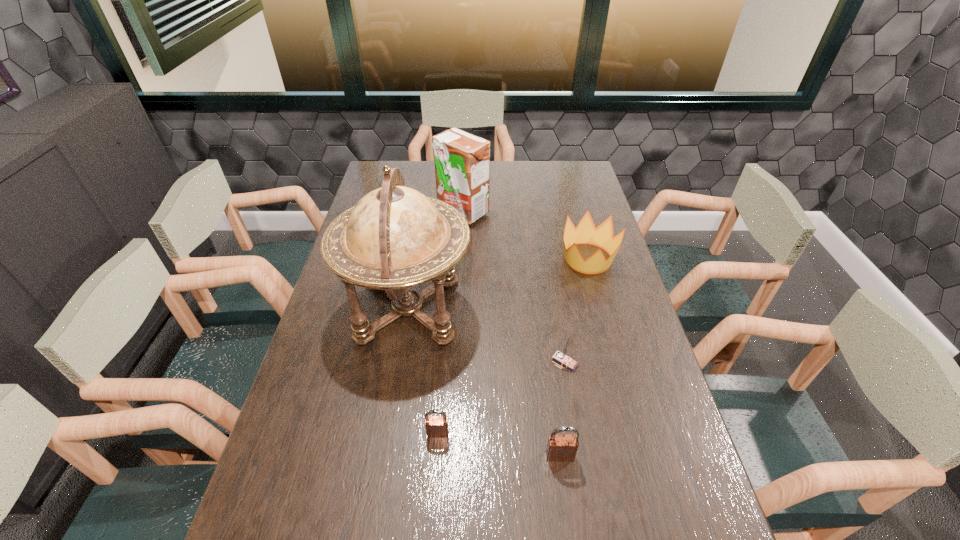
Find the location of a particular element. This screenshot has height=540, width=960. vacant space located 0.050m on the front-facing side of the nearest object is located at coordinates (x=564, y=484).

This screenshot has height=540, width=960. Find the location of `vacant area located 0.340m on the straw side of the farthest object`. vacant area located 0.340m on the straw side of the farthest object is located at coordinates (458, 292).

You are a GUI agent. You are given a task and a screenshot of the screen. Output one action in this format:
    pyautogui.click(x=<x>, y=<y>)
    Task: Click on the vacant area situated on the back of the matchbox
    
    Given the screenshot: What is the action you would take?
    pyautogui.click(x=548, y=264)

Locate an element on the screen. Image resolution: width=960 pixels, height=540 pixels. free space located 0.060m on the left of the crown is located at coordinates (540, 258).

Locate an element on the screen. blank space located 0.230m on the front-facing side of the tallest object is located at coordinates (548, 309).

You are a GUI agent. You are given a task and a screenshot of the screen. Output one action in this format:
    pyautogui.click(x=<x>, y=<y>)
    Task: Click on the object positioned at the left edge
    This screenshot has height=540, width=960.
    Given the screenshot: What is the action you would take?
    pyautogui.click(x=394, y=238)

At what (x,y) coordinates should I click in order to perform the action: click on object that is positioned at the right edge. Please return your answer as a coordinate pair (x, y). Looking at the image, I should click on (585, 233).

Find the location of `vacant space at the far edge of the desktop`. vacant space at the far edge of the desktop is located at coordinates (423, 174).

At what (x,y) coordinates should I click in order to perform the action: click on free space at the near edge of the desktop. Please return your answer as a coordinate pair (x, y). The height and width of the screenshot is (540, 960). Looking at the image, I should click on (341, 522).

You are a GUI agent. You are given a task and a screenshot of the screen. Output one action in this format:
    pyautogui.click(x=<x>, y=<y>)
    Task: Click on the vacant space at the left edge
    
    Given the screenshot: What is the action you would take?
    334,428